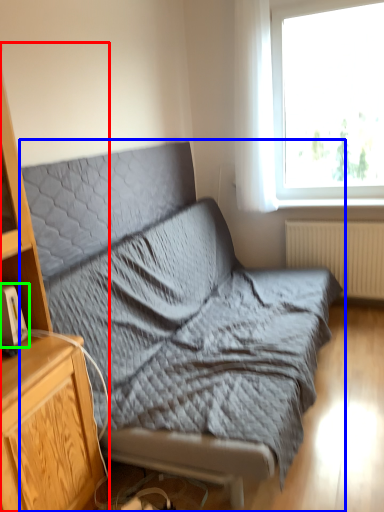
Question: Considering the real-world distances, which object is closest to cabinetry (highlighted by a red box)? studio couch (highlighted by a blue box) or gadget (highlighted by a green box).

Choices:
 (A) studio couch
 (B) gadget

Answer: (B)